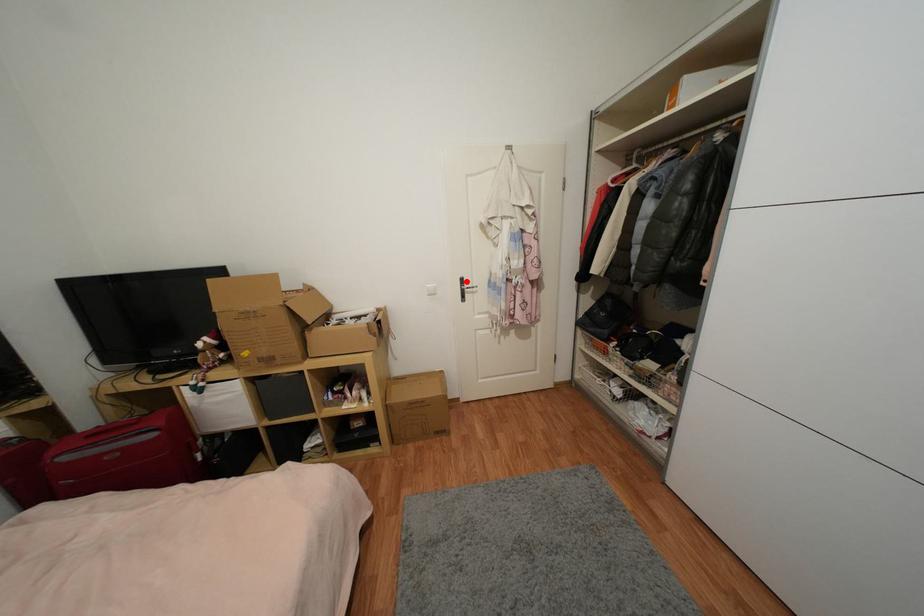
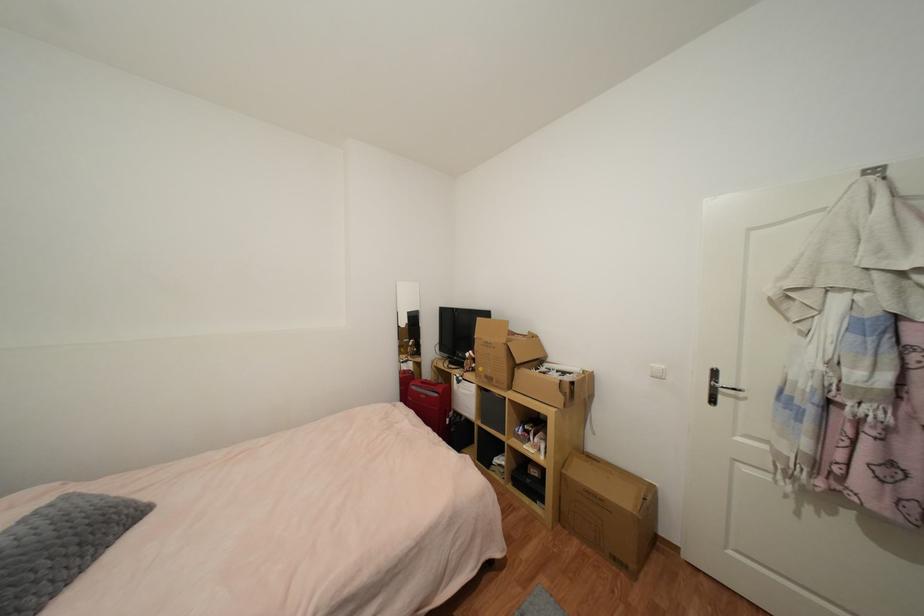
Locate, in the second image, the point that corresponds to the highlighted location in the first image.

(720, 374)